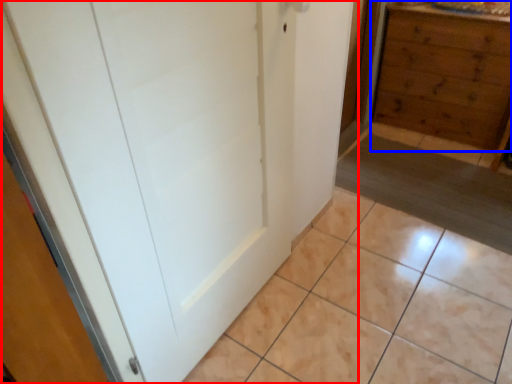
Question: Among these objects, which one is nearest to the camera, door (highlighted by a red box) or chest of drawers (highlighted by a blue box)?

Choices:
 (A) door
 (B) chest of drawers

Answer: (A)